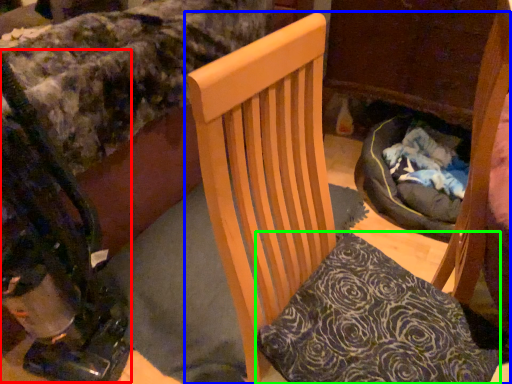
Question: Which object is the farthest from baby carriage (highlighted by a red box)? Choose among these: chair (highlighted by a blue box) or pillow (highlighted by a green box).

Choices:
 (A) chair
 (B) pillow

Answer: (B)